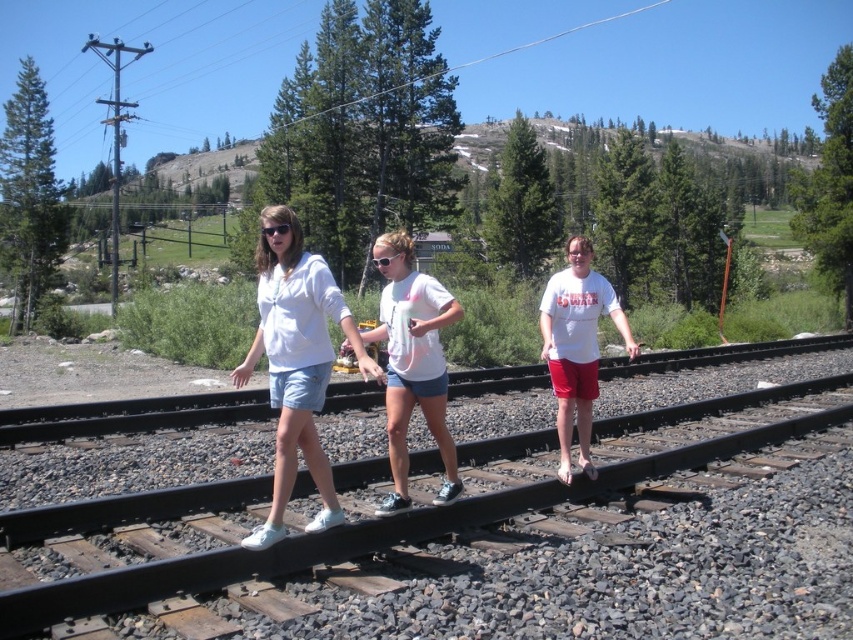
You are a maintenance worker responsible for inspecting the black metal train track at center. Your tool kit requires a minimum of 3 meters of space between the tracks to operate safely. Can you safely perform your inspection between the tracks?

The black metal train track at center are 4.02 meters apart, which is more than the required 3 meters of space. Therefore, you can safely perform your inspection between the tracks.

You are a photographer trying to capture a group photo of the white cotton shorts at center and the black plastic goggles at center. Since you want to ensure both subjects are in focus, which one should you focus on first based on their positions?

The white cotton shorts at center is taller than black plastic goggles at center, so you should focus on the white cotton shorts at center first as it is closer to the camera.

You are a photographer standing at the edge of the railway tracks. You want to take a picture of the black metal train track at center and the white cotton shorts at center. Which object should you focus on first if you want to capture both in sharp focus?

The black metal train track at center is below the white cotton shorts at center, so you should focus on the white cotton shorts at center first to ensure both are in sharp focus.